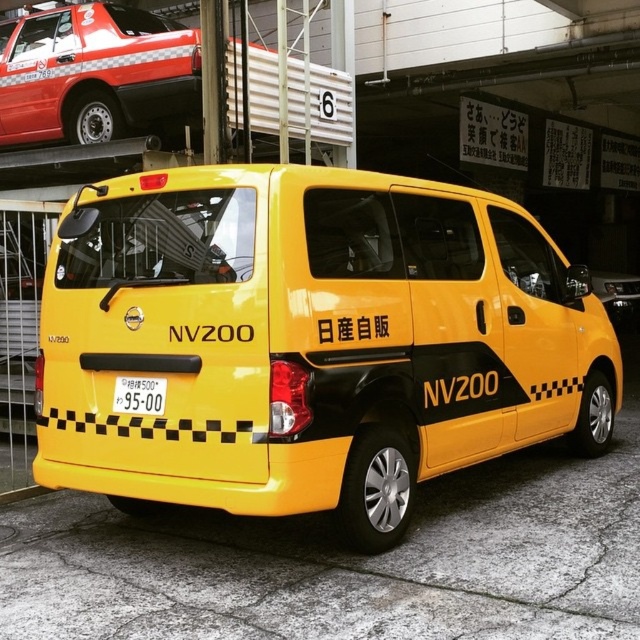
Question: Can you confirm if yellow matte van at center is smaller than yellow matte license plate at center?

Choices:
 (A) yes
 (B) no

Answer: (B)

Question: Is yellow matte van at center further to camera compared to matte black taxi at upper left?

Choices:
 (A) no
 (B) yes

Answer: (A)

Question: Among these points, which one is farthest from the camera?

Choices:
 (A) (161, 394)
 (B) (381, 234)
 (C) (109, 90)

Answer: (C)

Question: Which of the following is the farthest from the observer?

Choices:
 (A) yellow matte license plate at center
 (B) yellow matte van at center

Answer: (A)

Question: Is yellow matte van at center positioned at the back of matte black taxi at upper left?

Choices:
 (A) yes
 (B) no

Answer: (B)

Question: Among these objects, which one is nearest to the camera?

Choices:
 (A) matte black taxi at upper left
 (B) yellow matte license plate at center

Answer: (B)